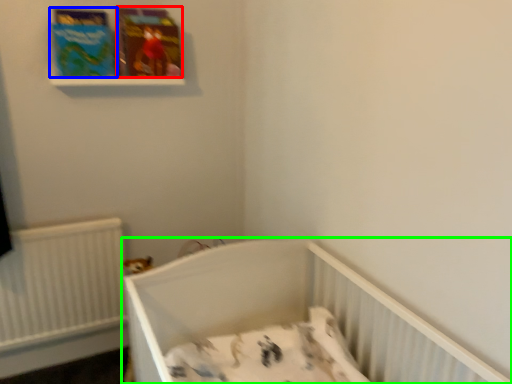
Question: Which object is positioned farthest from paperback book (highlighted by a red box)? Select from paperback book (highlighted by a blue box) and infant bed (highlighted by a green box).

Choices:
 (A) paperback book
 (B) infant bed

Answer: (B)